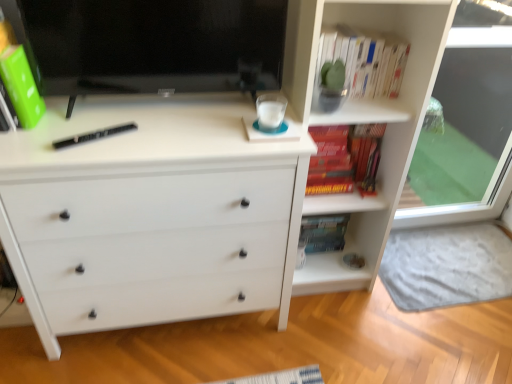
You are a GUI agent. You are given a task and a screenshot of the screen. Output one action in this format:
    pyautogui.click(x=<x>, y=<y>)
    Task: Click on the blank space to the left of black hardback book at center
    The width and height of the screenshot is (512, 384).
    Given the screenshot: What is the action you would take?
    pyautogui.click(x=44, y=138)